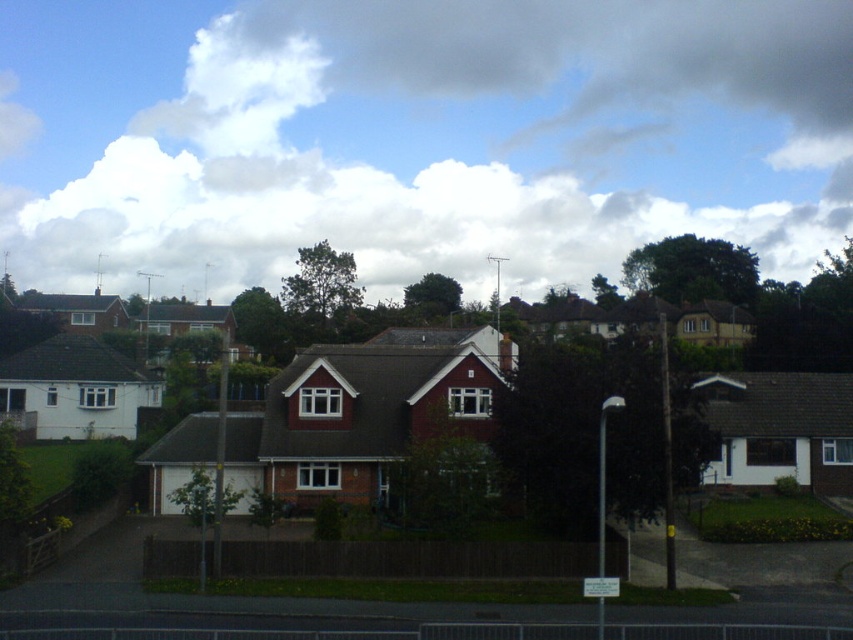
Question: Among these points, which one is farthest from the camera?

Choices:
 (A) (364, 547)
 (B) (616, 0)

Answer: (B)

Question: Does white fluffy cloud at upper center appear under brown wooden fence at center?

Choices:
 (A) yes
 (B) no

Answer: (B)

Question: Is white fluffy cloud at upper center smaller than brown wooden fence at center?

Choices:
 (A) yes
 (B) no

Answer: (B)

Question: Does white fluffy cloud at upper center have a smaller size compared to brown wooden fence at center?

Choices:
 (A) yes
 (B) no

Answer: (B)